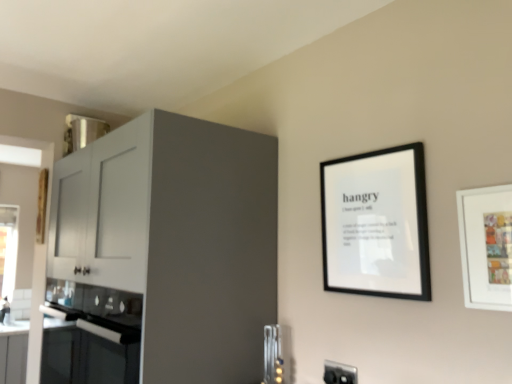
Question: Does metallic silver utensils at lower center appear on the left side of matte white cabinet at left?

Choices:
 (A) no
 (B) yes

Answer: (A)

Question: Is metallic silver utensils at lower center wider than matte white cabinet at left?

Choices:
 (A) no
 (B) yes

Answer: (A)

Question: Is metallic silver utensils at lower center looking in the opposite direction of matte white cabinet at left?

Choices:
 (A) yes
 (B) no

Answer: (B)

Question: Considering the relative sizes of metallic silver utensils at lower center and matte white cabinet at left in the image provided, is metallic silver utensils at lower center shorter than matte white cabinet at left?

Choices:
 (A) no
 (B) yes

Answer: (B)

Question: Could you tell me if metallic silver utensils at lower center is facing matte white cabinet at left?

Choices:
 (A) no
 (B) yes

Answer: (B)

Question: From a real-world perspective, is metallic silver utensils at lower center positioned under matte white cabinet at left based on gravity?

Choices:
 (A) yes
 (B) no

Answer: (A)

Question: Is black plastic electric outlet at lower right thinner than white matte picture frame at right, which appears as the first picture frame when viewed from the right?

Choices:
 (A) no
 (B) yes

Answer: (B)

Question: From the image's perspective, is black plastic electric outlet at lower right beneath white matte picture frame at right, which appears as the first picture frame when viewed from the right?

Choices:
 (A) no
 (B) yes

Answer: (B)

Question: Would you say white matte picture frame at right, positioned as the 2th picture frame in left-to-right order, is part of black plastic electric outlet at lower right's contents?

Choices:
 (A) no
 (B) yes

Answer: (A)

Question: Is black plastic electric outlet at lower right to the left of white matte picture frame at right, the 1th picture frame viewed from the front, from the viewer's perspective?

Choices:
 (A) yes
 (B) no

Answer: (A)

Question: From the image's perspective, does black plastic electric outlet at lower right appear higher than white matte picture frame at right, which is the 2th picture frame from back to front?

Choices:
 (A) no
 (B) yes

Answer: (A)

Question: Does black plastic electric outlet at lower right have a greater height compared to white matte picture frame at right, which is the 2th picture frame from back to front?

Choices:
 (A) yes
 (B) no

Answer: (B)

Question: Is white matte picture frame at right, positioned as the 2th picture frame in left-to-right order, shorter than black matte picture frame at upper right, acting as the 1th picture frame starting from the left?

Choices:
 (A) no
 (B) yes

Answer: (B)